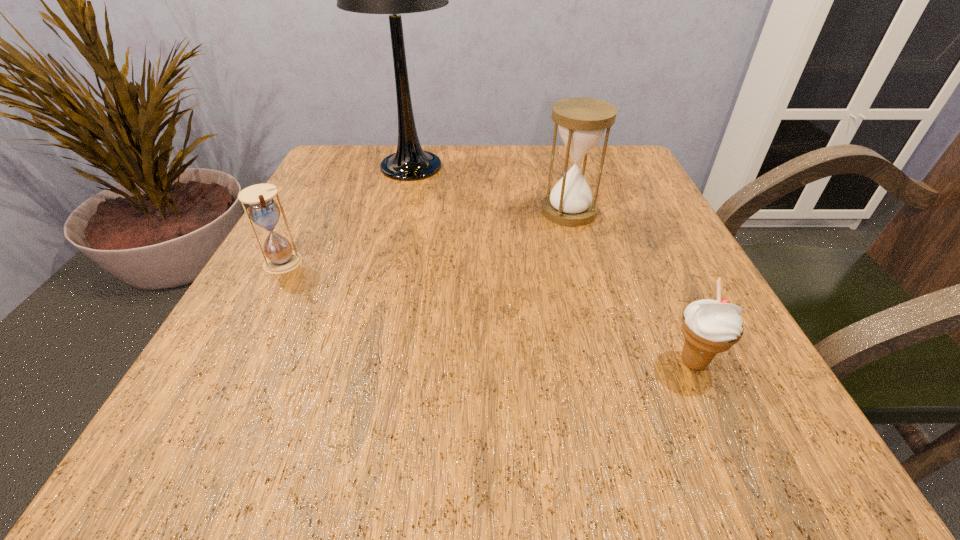
I want to click on the farthest object, so [x=410, y=162].

You are a GUI agent. You are given a task and a screenshot of the screen. Output one action in this format:
    pyautogui.click(x=<x>, y=<y>)
    Task: Click on the third object from right to left
    The width and height of the screenshot is (960, 540).
    Given the screenshot: What is the action you would take?
    click(410, 162)

I want to click on the farther hourglass, so click(x=581, y=121).

Locate an element on the screen. The height and width of the screenshot is (540, 960). the second tallest object is located at coordinates (581, 121).

Where is `the third farthest object`? the third farthest object is located at coordinates (263, 210).

This screenshot has width=960, height=540. Find the location of `the second shortest object`. the second shortest object is located at coordinates (263, 210).

You are a GUI agent. You are given a task and a screenshot of the screen. Output one action in this format:
    pyautogui.click(x=<x>, y=<y>)
    Task: Click on the rightmost object
    The height and width of the screenshot is (540, 960).
    Given the screenshot: What is the action you would take?
    pyautogui.click(x=709, y=326)

At what (x,y) coordinates should I click in order to perform the action: click on the shortest object. Please return your answer as a coordinate pair (x, y). The width and height of the screenshot is (960, 540). Looking at the image, I should click on (709, 326).

At what (x,y) coordinates should I click in order to perform the action: click on vacant area situated on the front of the second object from left to right. Please return your answer as a coordinate pair (x, y). Looking at the image, I should click on [376, 303].

The width and height of the screenshot is (960, 540). Find the location of `free space located on the front of the third object from left to right`. free space located on the front of the third object from left to right is located at coordinates click(x=590, y=289).